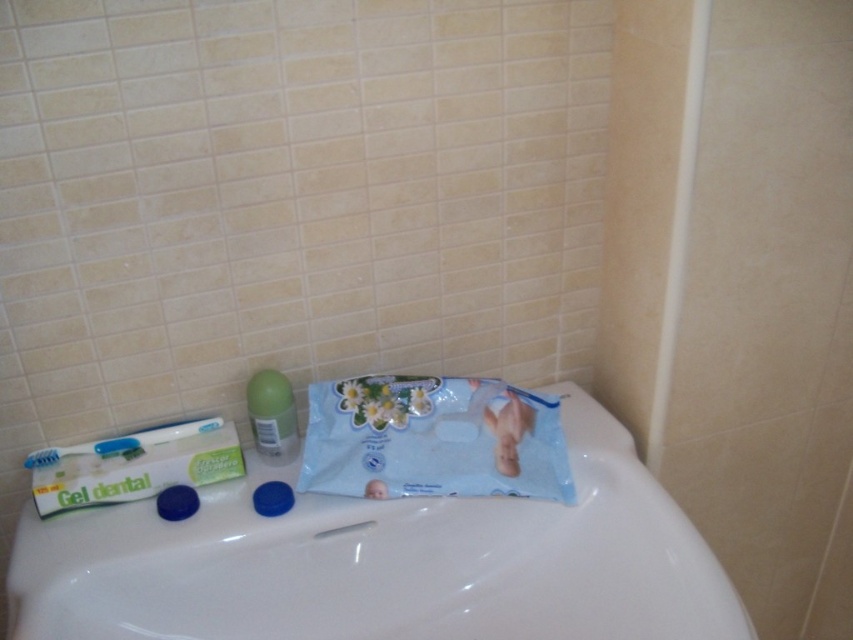
Between white matte toothpaste at lower left and green matte deodorant at center, which one has more height?

green matte deodorant at center is taller.

Where is `white matte toothpaste at lower left`? white matte toothpaste at lower left is located at coordinates (135, 465).

Does white glossy sink at center have a greater height compared to green matte deodorant at center?

Yes, white glossy sink at center is taller than green matte deodorant at center.

Is white glossy sink at center to the right of green matte deodorant at center from the viewer's perspective?

Indeed, white glossy sink at center is positioned on the right side of green matte deodorant at center.

Which is behind, point (219, 564) or point (296, 442)?

The point (296, 442) is more distant.

Find the location of a particular element. This screenshot has height=640, width=853. white glossy sink at center is located at coordinates (384, 563).

Is white glossy sink at center behind blue plastic toothbrush at left?

No, white glossy sink at center is closer to the viewer.

Does white glossy sink at center appear on the right side of blue plastic toothbrush at left?

Correct, you'll find white glossy sink at center to the right of blue plastic toothbrush at left.

Is point (305, 611) positioned after point (177, 436)?

No, (305, 611) is closer to viewer.

Image resolution: width=853 pixels, height=640 pixels. Identify the location of white glossy sink at center. click(x=384, y=563).